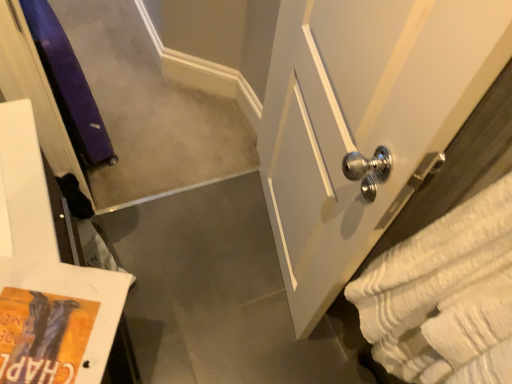
Question: From a real-world perspective, is white textured bath towel at right over white glossy door at right?

Choices:
 (A) no
 (B) yes

Answer: (B)

Question: Considering the relative sizes of white textured bath towel at right and white glossy door at right in the image provided, is white textured bath towel at right shorter than white glossy door at right?

Choices:
 (A) no
 (B) yes

Answer: (B)

Question: Is the depth of white textured bath towel at right greater than that of white glossy door at right?

Choices:
 (A) yes
 (B) no

Answer: (B)

Question: Considering the relative positions of white textured bath towel at right and white glossy door at right in the image provided, is white textured bath towel at right to the left of white glossy door at right from the viewer's perspective?

Choices:
 (A) yes
 (B) no

Answer: (B)

Question: From the image's perspective, does white textured bath towel at right appear lower than white glossy door at right?

Choices:
 (A) no
 (B) yes

Answer: (B)

Question: Would you consider white textured bath towel at right to be distant from white glossy door at right?

Choices:
 (A) yes
 (B) no

Answer: (B)

Question: Can we say white glossy door at right lies outside white textured bath towel at right?

Choices:
 (A) no
 (B) yes

Answer: (B)

Question: From a real-world perspective, is white glossy door at right on top of white textured bath towel at right?

Choices:
 (A) yes
 (B) no

Answer: (B)

Question: Would you say white glossy door at right is a long distance from white textured bath towel at right?

Choices:
 (A) yes
 (B) no

Answer: (B)

Question: Considering the relative sizes of white glossy door at right and white textured bath towel at right in the image provided, is white glossy door at right wider than white textured bath towel at right?

Choices:
 (A) yes
 (B) no

Answer: (B)

Question: From the image's perspective, is white glossy door at right beneath white textured bath towel at right?

Choices:
 (A) yes
 (B) no

Answer: (B)

Question: Considering the relative sizes of white glossy door at right and white textured bath towel at right in the image provided, is white glossy door at right bigger than white textured bath towel at right?

Choices:
 (A) no
 (B) yes

Answer: (B)

Question: Considering the positions of point (505, 342) and point (263, 167), is point (505, 342) closer or farther from the camera than point (263, 167)?

Choices:
 (A) closer
 (B) farther

Answer: (A)